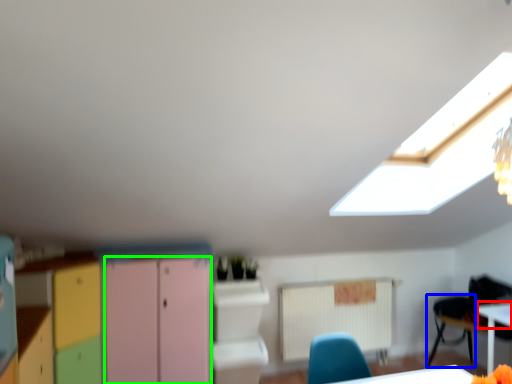
Question: Estimate the real-world distances between objects in this image. Which object is farther from table top (highlighted by a red box), armchair (highlighted by a blue box) or file cabinet (highlighted by a green box)?

Choices:
 (A) armchair
 (B) file cabinet

Answer: (B)